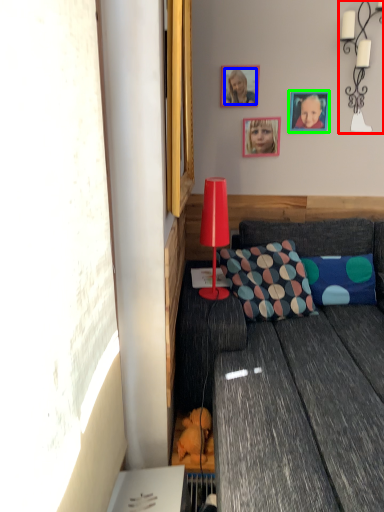
Question: Which object is positioned closest to lamp (highlighted by a red box)? Select from person (highlighted by a blue box) and picture frame (highlighted by a green box).

Choices:
 (A) person
 (B) picture frame

Answer: (B)